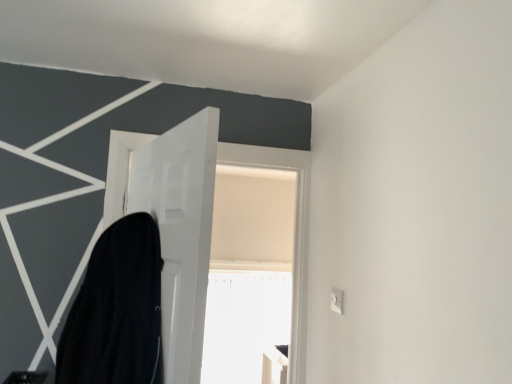
Question: Does black matte robe at left touch white matte door at center?

Choices:
 (A) yes
 (B) no

Answer: (B)

Question: Does black matte robe at left have a greater height compared to white matte door at center?

Choices:
 (A) no
 (B) yes

Answer: (A)

Question: Does black matte robe at left turn towards white matte door at center?

Choices:
 (A) no
 (B) yes

Answer: (B)

Question: Does black matte robe at left have a smaller size compared to white matte door at center?

Choices:
 (A) yes
 (B) no

Answer: (A)

Question: Is black matte robe at left at the right side of white matte door at center?

Choices:
 (A) no
 (B) yes

Answer: (A)

Question: Is black matte robe at left thinner than white matte door at center?

Choices:
 (A) no
 (B) yes

Answer: (A)

Question: Does white matte door at center appear on the left side of black matte robe at left?

Choices:
 (A) no
 (B) yes

Answer: (A)

Question: From a real-world perspective, is white matte door at center beneath black matte robe at left?

Choices:
 (A) yes
 (B) no

Answer: (B)

Question: Can you confirm if white matte door at center is bigger than black matte robe at left?

Choices:
 (A) no
 (B) yes

Answer: (B)

Question: Are white matte door at center and black matte robe at left making contact?

Choices:
 (A) no
 (B) yes

Answer: (A)

Question: Considering the relative positions of white matte door at center and black matte robe at left in the image provided, is white matte door at center behind black matte robe at left?

Choices:
 (A) no
 (B) yes

Answer: (B)

Question: Can you confirm if white matte door at center is taller than black matte robe at left?

Choices:
 (A) yes
 (B) no

Answer: (A)

Question: Considering their positions, is black matte robe at left located in front of or behind white matte door at center?

Choices:
 (A) front
 (B) behind

Answer: (A)